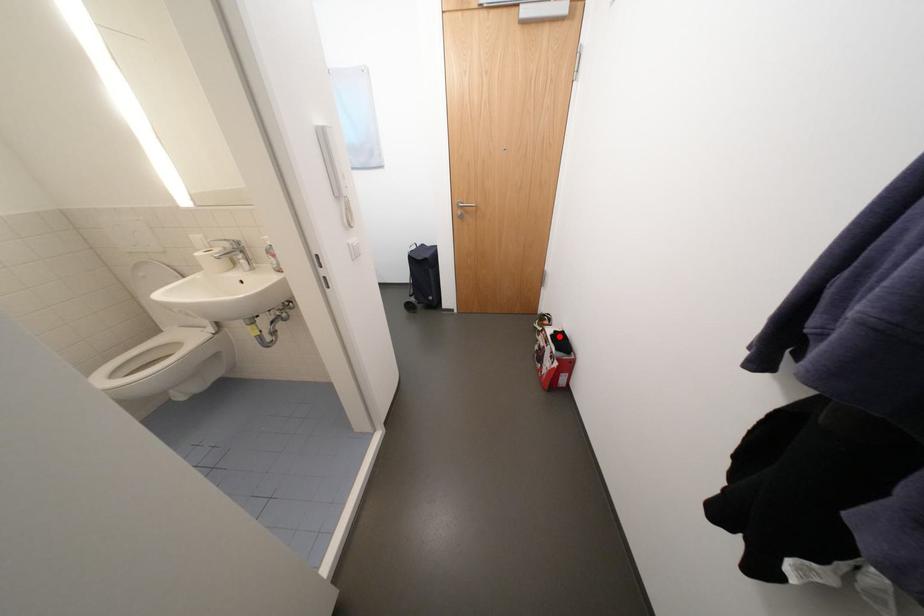
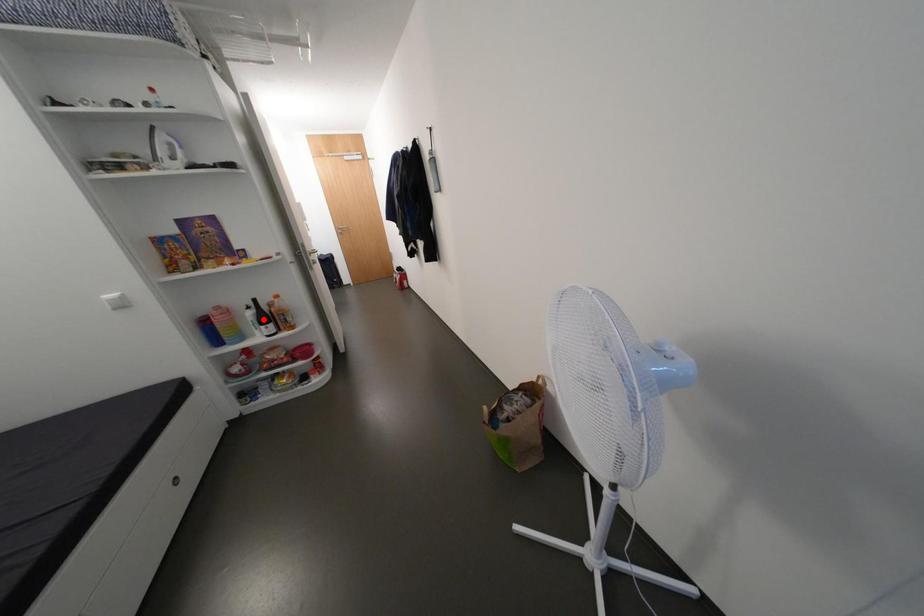
I am providing you with two images of the same scene from different viewpoints. A red point is marked on the first image and another point is marked on the second image. Does the point marked in image1 correspond to the same location as the one in image2?

No